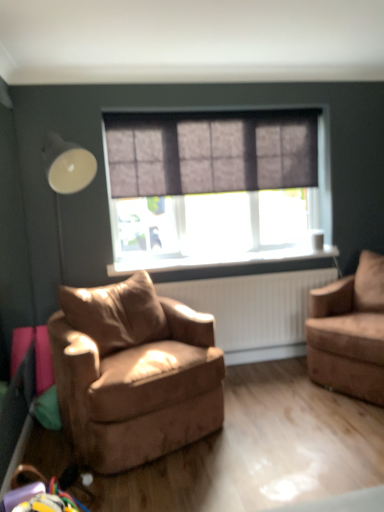
Question: Is point (334, 250) positioned closer to the camera than point (59, 151)?

Choices:
 (A) closer
 (B) farther

Answer: (B)

Question: From the image's perspective, relative to white glossy table lamp at left, is black plastic window sill at center above or below?

Choices:
 (A) below
 (B) above

Answer: (A)

Question: Which object is positioned closest to the black plastic window sill at center?

Choices:
 (A) suede brown armchair at right, the second chair from the left
 (B) white glossy table lamp at left
 (C) dark grey textured curtain at center
 (D) brown leather chair at center, the 2th chair viewed from the right

Answer: (A)

Question: Which of these objects is positioned farthest from the suede brown armchair at right, which ranks as the first chair in right-to-left order?

Choices:
 (A) white glossy table lamp at left
 (B) brown leather chair at center, the 2th chair viewed from the right
 (C) black plastic window sill at center
 (D) dark grey textured curtain at center

Answer: (A)